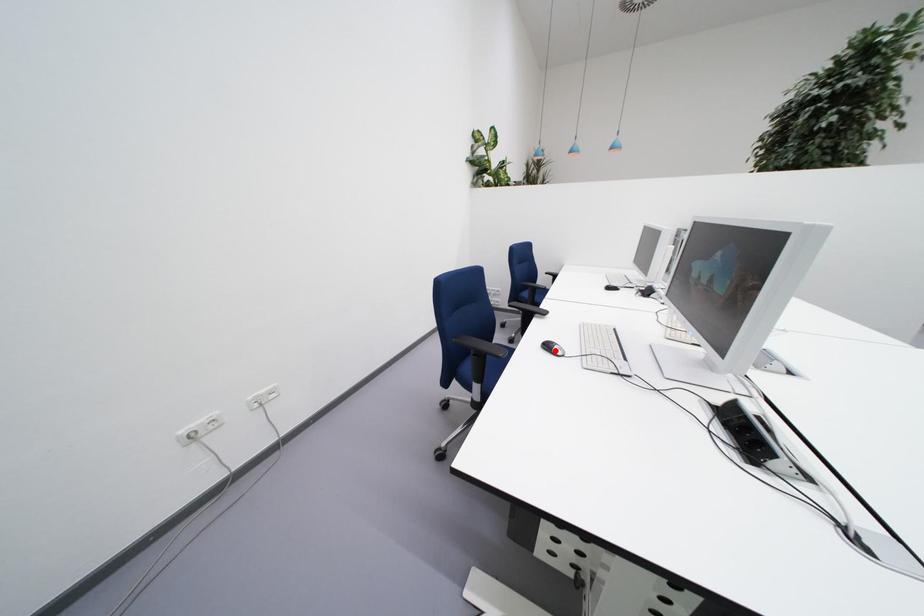
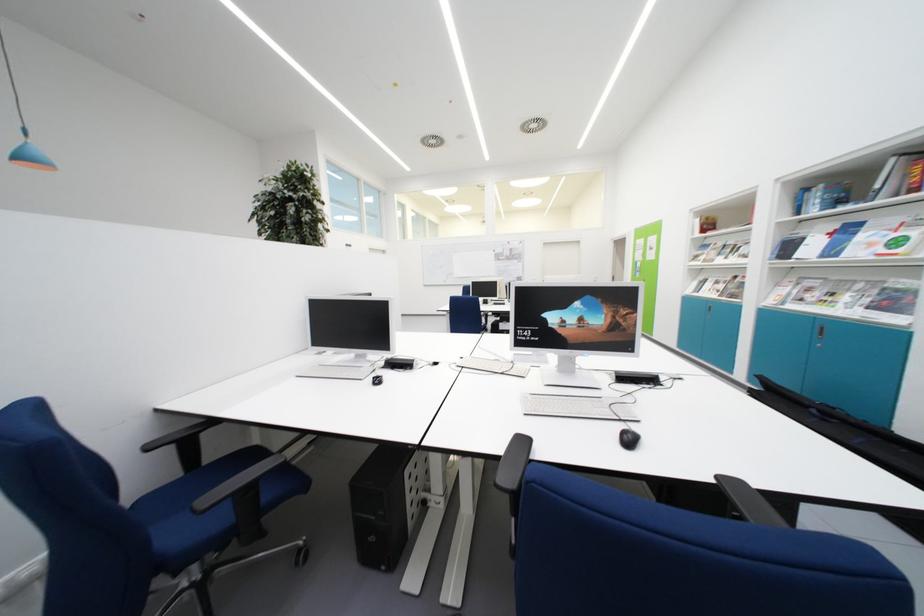
Where in the second image is the point corresponding to the highlighted location from the first image?

(637, 446)